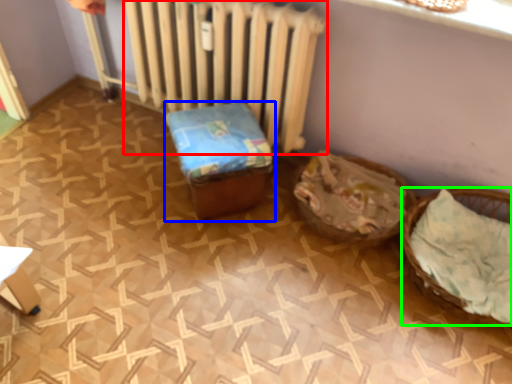
Question: Estimate the real-world distances between objects in this image. Which object is closer to radiator (highlighted by a red box), furniture (highlighted by a blue box) or basket (highlighted by a green box)?

Choices:
 (A) furniture
 (B) basket

Answer: (A)